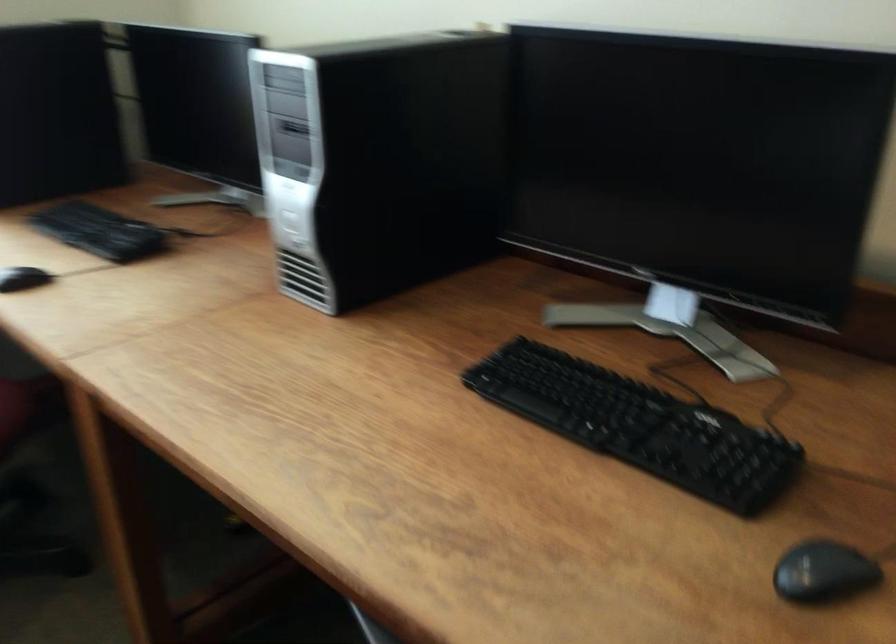
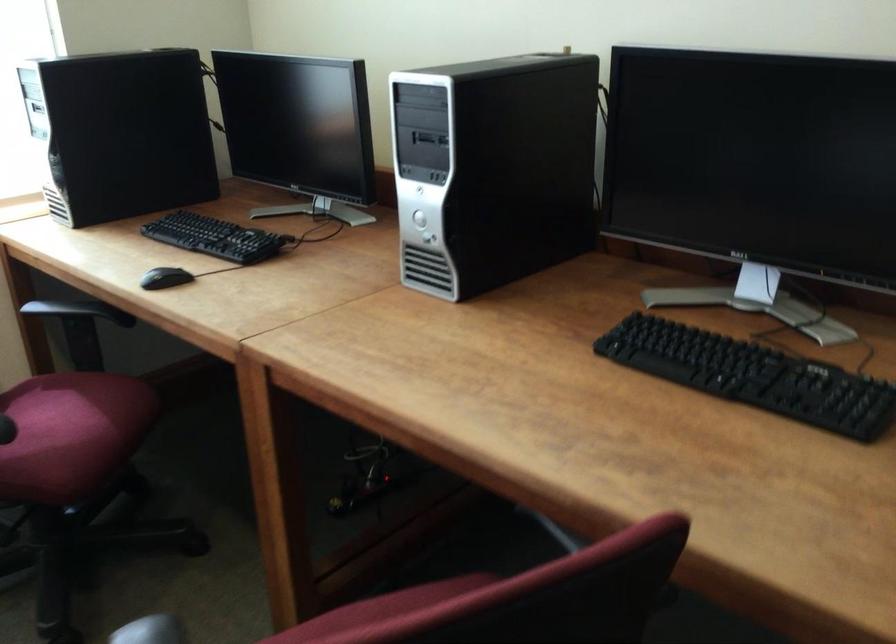
In the second image, find the point that corresponds to (x=631, y=424) in the first image.

(753, 375)